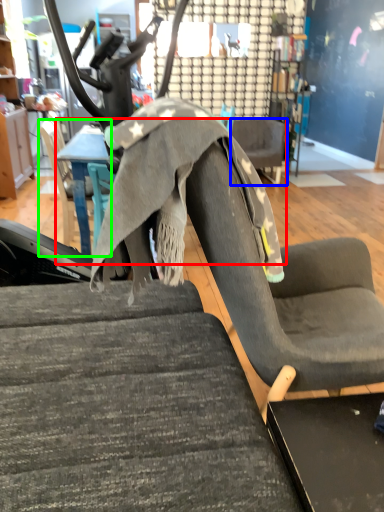
Question: Considering the real-world distances, which object is farthest from table (highlighted by a red box)? chair (highlighted by a blue box) or chair (highlighted by a green box)?

Choices:
 (A) chair
 (B) chair

Answer: (A)